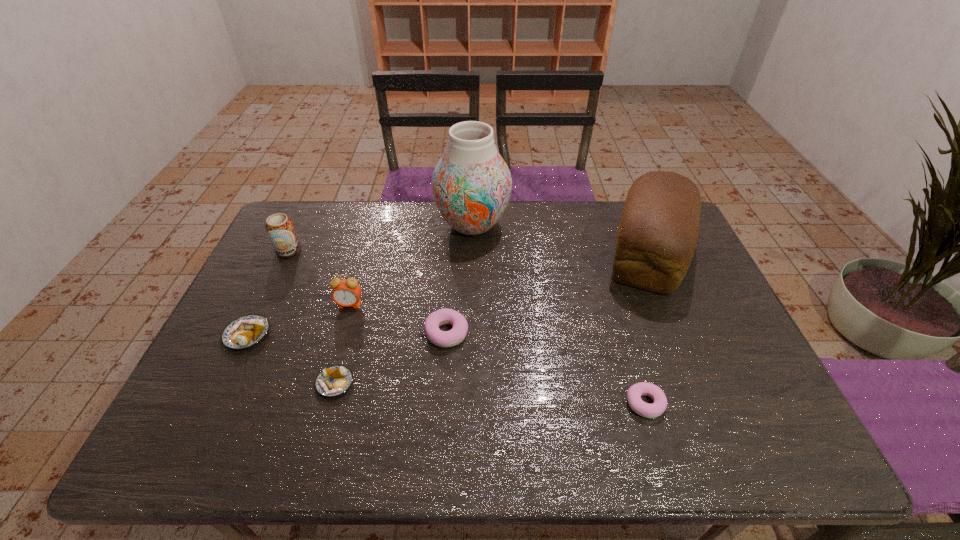
This screenshot has width=960, height=540. In order to click on the nearer pink pastry in this screenshot , I will do `click(634, 393)`.

The height and width of the screenshot is (540, 960). I want to click on the nearer brown pastry, so click(333, 381).

This screenshot has height=540, width=960. Identify the location of the smaller brown pastry. (333, 381).

Find the location of a particular element. This screenshot has width=960, height=540. vacant space located on the right of the tallest object is located at coordinates (585, 225).

Image resolution: width=960 pixels, height=540 pixels. Identify the location of vacant space located on the front of the bread. (714, 414).

Image resolution: width=960 pixels, height=540 pixels. What are the coordinates of `free space located 0.400m on the front of the beer can` in the screenshot? It's located at (234, 364).

This screenshot has width=960, height=540. I want to click on vacant space located on the face of the alarm clock, so click(x=329, y=376).

Identify the location of vacant space located 0.220m on the left of the second pastry from right to left. This screenshot has height=540, width=960. (344, 333).

Locate an element on the screen. The width and height of the screenshot is (960, 540). vacant space situated 0.230m on the front of the bigger brown pastry is located at coordinates (198, 438).

The height and width of the screenshot is (540, 960). I want to click on free location located 0.320m on the back of the rightmost pastry, so click(612, 292).